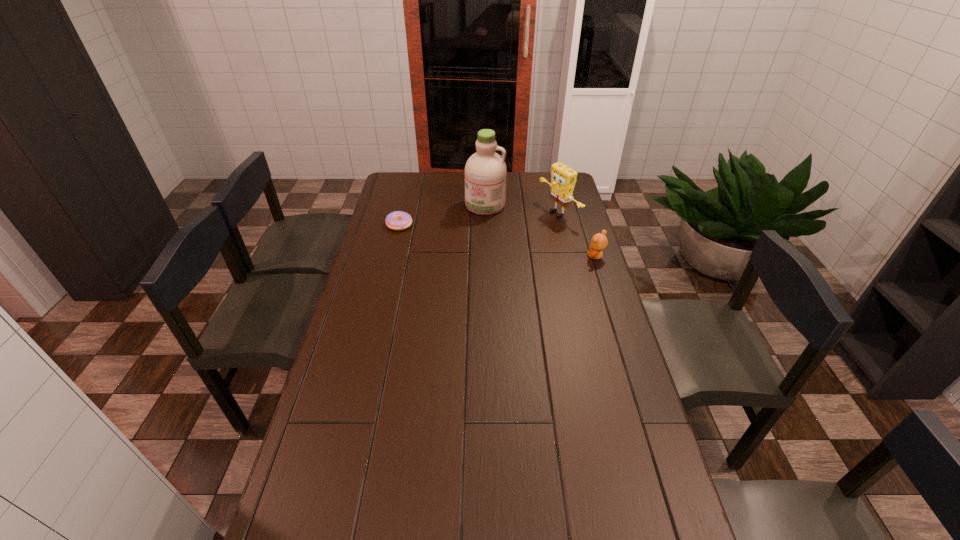
At what (x,y) coordinates should I click in order to perform the action: click on the leftmost object. Please return your answer as a coordinate pair (x, y). Looking at the image, I should click on (398, 220).

At what (x,y) coordinates should I click in order to perform the action: click on doughnut. Please return your answer as a coordinate pair (x, y). Looking at the image, I should click on (398, 220).

The height and width of the screenshot is (540, 960). I want to click on teddy bear, so click(599, 241).

Identify the location of the nearest object. (599, 241).

Where is `the third shortest object`? the third shortest object is located at coordinates (563, 179).

Locate an element on the screen. the third object from right to left is located at coordinates (485, 171).

Find the location of a particular element. This screenshot has width=960, height=540. cleansing agent is located at coordinates (485, 171).

Find the location of a particular element. The height and width of the screenshot is (540, 960). vacant area situated on the back of the leftmost object is located at coordinates (403, 210).

Locate an element on the screen. This screenshot has height=540, width=960. vacant region located 0.330m on the face of the nearest object is located at coordinates (506, 256).

The image size is (960, 540). In order to click on vacant space located 0.320m on the face of the nearest object in this screenshot , I will do `click(509, 256)`.